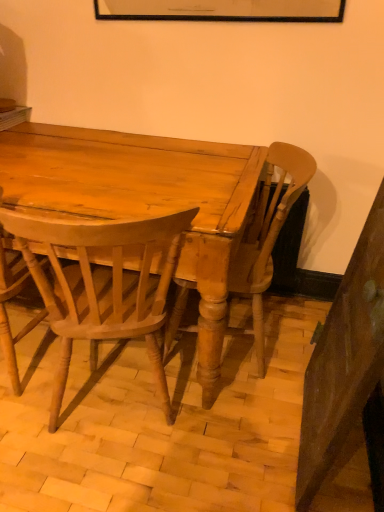
I want to click on matte wood desk at center, so click(144, 200).

What is the approximate width of light brown wood chair at center, acting as the 2th chair starting from the left?

light brown wood chair at center, acting as the 2th chair starting from the left, is 22.82 inches wide.

I want to click on light brown wood chair at center, placed as the 1th chair when sorted from right to left, so click(x=268, y=234).

From a real-world perspective, is matte wood desk at center positioned over light brown wood chair at center, marked as the third chair in a left-to-right arrangement, based on gravity?

Incorrect, from a real-world perspective, matte wood desk at center is lower than light brown wood chair at center, marked as the third chair in a left-to-right arrangement.

Based on the photo, from the image's perspective, is matte wood desk at center located beneath light brown wood chair at center, placed as the 1th chair when sorted from right to left?

Incorrect, from the image's perspective, matte wood desk at center is higher than light brown wood chair at center, placed as the 1th chair when sorted from right to left.

Is matte wood desk at center to the right of light brown wood chair at center, marked as the third chair in a left-to-right arrangement, from the viewer's perspective?

Incorrect, matte wood desk at center is not on the right side of light brown wood chair at center, marked as the third chair in a left-to-right arrangement.

Image resolution: width=384 pixels, height=512 pixels. Find the location of `the 2nd chair below the light brown wood chair at center, placed as the 1th chair when sorted from right to left (from the image's perspective)`. the 2nd chair below the light brown wood chair at center, placed as the 1th chair when sorted from right to left (from the image's perspective) is located at coordinates (102, 285).

Is light brown wood chair at center, the 2th chair from the right, directly adjacent to light brown wood chair at center, placed as the 1th chair when sorted from right to left?

No, light brown wood chair at center, the 2th chair from the right, is not with light brown wood chair at center, placed as the 1th chair when sorted from right to left.

Which object is further away from the camera, light brown wood chair at center, the 2th chair from the right, or light brown wood chair at center, placed as the 1th chair when sorted from right to left?

light brown wood chair at center, placed as the 1th chair when sorted from right to left, is further away from the camera.

How many degrees apart are the facing directions of light brown wood chair at center, acting as the 2th chair starting from the left, and light brown wood chair at center, marked as the third chair in a left-to-right arrangement?

There is a 73.2-degree angle between the facing directions of light brown wood chair at center, acting as the 2th chair starting from the left, and light brown wood chair at center, marked as the third chair in a left-to-right arrangement.

Does light brown wood chair at center, the 3th chair in the right-to-left sequence, have a lesser width compared to light brown wood chair at center, marked as the third chair in a left-to-right arrangement?

Incorrect, the width of light brown wood chair at center, the 3th chair in the right-to-left sequence, is not less than that of light brown wood chair at center, marked as the third chair in a left-to-right arrangement.

Are light brown wood chair at center, which ranks as the 1th chair in left-to-right order, and light brown wood chair at center, marked as the third chair in a left-to-right arrangement, located far from each other?

That's not correct — light brown wood chair at center, which ranks as the 1th chair in left-to-right order, is a little close to light brown wood chair at center, marked as the third chair in a left-to-right arrangement.

Is light brown wood chair at center, the 3th chair in the right-to-left sequence, looking in the opposite direction of light brown wood chair at center, placed as the 1th chair when sorted from right to left?

No, light brown wood chair at center, the 3th chair in the right-to-left sequence, is not facing away from light brown wood chair at center, placed as the 1th chair when sorted from right to left.

Who is more distant, light brown wood chair at center, which ranks as the 1th chair in left-to-right order, or light brown wood chair at center, marked as the third chair in a left-to-right arrangement?

light brown wood chair at center, marked as the third chair in a left-to-right arrangement, is behind.

Can you confirm if light brown wood chair at center, placed as the 1th chair when sorted from right to left, is bigger than light brown wood chair at center, the 3th chair in the right-to-left sequence?

Indeed, light brown wood chair at center, placed as the 1th chair when sorted from right to left, has a larger size compared to light brown wood chair at center, the 3th chair in the right-to-left sequence.

From the image's perspective, does light brown wood chair at center, marked as the third chair in a left-to-right arrangement, appear lower than light brown wood chair at center, the 3th chair in the right-to-left sequence?

Incorrect, from the image's perspective, light brown wood chair at center, marked as the third chair in a left-to-right arrangement, is higher than light brown wood chair at center, the 3th chair in the right-to-left sequence.

In the image, is light brown wood chair at center, placed as the 1th chair when sorted from right to left, positioned in front of or behind light brown wood chair at center, which ranks as the 1th chair in left-to-right order?

light brown wood chair at center, placed as the 1th chair when sorted from right to left, is positioned farther from the viewer than light brown wood chair at center, which ranks as the 1th chair in left-to-right order.

Considering the relative sizes of light brown wood chair at center, marked as the third chair in a left-to-right arrangement, and light brown wood chair at center, the 3th chair in the right-to-left sequence, in the image provided, is light brown wood chair at center, marked as the third chair in a left-to-right arrangement, taller than light brown wood chair at center, the 3th chair in the right-to-left sequence,?

Correct, light brown wood chair at center, marked as the third chair in a left-to-right arrangement, is much taller as light brown wood chair at center, the 3th chair in the right-to-left sequence.

In the scene shown: Between light brown wood chair at center, acting as the 2th chair starting from the left, and matte wood desk at center, which one has larger width?

Wider between the two is matte wood desk at center.

In the scene shown: Does light brown wood chair at center, the 2th chair from the right, contain matte wood desk at center?

Actually, matte wood desk at center is outside light brown wood chair at center, the 2th chair from the right.

Is light brown wood chair at center, the 2th chair from the right, aimed at matte wood desk at center?

Yes, light brown wood chair at center, the 2th chair from the right, is facing matte wood desk at center.

Which object is positioned more to the left, light brown wood chair at center, acting as the 2th chair starting from the left, or light brown wood chair at center, which ranks as the 1th chair in left-to-right order?

Positioned to the left is light brown wood chair at center, which ranks as the 1th chair in left-to-right order.

Based on the photo, how many degrees apart are the facing directions of light brown wood chair at center, the 2th chair from the right, and light brown wood chair at center, which ranks as the 1th chair in left-to-right order?

22 degrees separate the facing orientations of light brown wood chair at center, the 2th chair from the right, and light brown wood chair at center, which ranks as the 1th chair in left-to-right order.

Between light brown wood chair at center, acting as the 2th chair starting from the left, and light brown wood chair at center, which ranks as the 1th chair in left-to-right order, which one has less height?

Standing shorter between the two is light brown wood chair at center, acting as the 2th chair starting from the left.

Between light brown wood chair at center, acting as the 2th chair starting from the left, and light brown wood chair at center, which ranks as the 1th chair in left-to-right order, which one has smaller size?

light brown wood chair at center, which ranks as the 1th chair in left-to-right order, is smaller.

Where is `desk below the light brown wood chair at center, the 2th chair from the right (from a real-world perspective)`? The image size is (384, 512). desk below the light brown wood chair at center, the 2th chair from the right (from a real-world perspective) is located at coordinates (144, 200).

Based on the photo, does matte wood desk at center have a larger size compared to light brown wood chair at center, the 2th chair from the right?

Correct, matte wood desk at center is larger in size than light brown wood chair at center, the 2th chair from the right.

From the picture: Is matte wood desk at center not inside light brown wood chair at center, the 2th chair from the right?

Indeed, matte wood desk at center is completely outside light brown wood chair at center, the 2th chair from the right.

Who is taller, matte wood desk at center or light brown wood chair at center, acting as the 2th chair starting from the left?

Standing taller between the two is light brown wood chair at center, acting as the 2th chair starting from the left.

What are the coordinates of `desk located on the left of light brown wood chair at center, marked as the third chair in a left-to-right arrangement` in the screenshot? It's located at (144, 200).

Starting from the light brown wood chair at center, acting as the 2th chair starting from the left, which chair is the 2nd one behind? Please provide its 2D coordinates.

[(268, 234)]

Considering their positions, is light brown wood chair at center, placed as the 1th chair when sorted from right to left, positioned closer to light brown wood chair at center, acting as the 2th chair starting from the left, than light brown wood chair at center, the 3th chair in the right-to-left sequence?

Based on the image, light brown wood chair at center, the 3th chair in the right-to-left sequence, appears to be nearer to light brown wood chair at center, acting as the 2th chair starting from the left.

In the scene shown: Which object lies further to the anchor point light brown wood chair at center, marked as the third chair in a left-to-right arrangement, light brown wood chair at center, the 3th chair in the right-to-left sequence, or light brown wood chair at center, acting as the 2th chair starting from the left?

light brown wood chair at center, the 3th chair in the right-to-left sequence, lies further to light brown wood chair at center, marked as the third chair in a left-to-right arrangement, than the other object.

Based on their spatial positions, is light brown wood chair at center, placed as the 1th chair when sorted from right to left, or light brown wood chair at center, acting as the 2th chair starting from the left, closer to matte wood desk at center?

light brown wood chair at center, acting as the 2th chair starting from the left, is positioned closer to the anchor matte wood desk at center.

Estimate the real-world distances between objects in this image. Which object is closer to matte wood desk at center, light brown wood chair at center, acting as the 2th chair starting from the left, or light brown wood chair at center, the 3th chair in the right-to-left sequence?

light brown wood chair at center, acting as the 2th chair starting from the left, is positioned closer to the anchor matte wood desk at center.

Considering their positions, is light brown wood chair at center, the 2th chair from the right, positioned further to matte wood desk at center than light brown wood chair at center, marked as the third chair in a left-to-right arrangement?

light brown wood chair at center, marked as the third chair in a left-to-right arrangement, is positioned further to the anchor matte wood desk at center.

Based on their spatial positions, is light brown wood chair at center, acting as the 2th chair starting from the left, or light brown wood chair at center, which ranks as the 1th chair in left-to-right order, closer to light brown wood chair at center, placed as the 1th chair when sorted from right to left?

The object closer to light brown wood chair at center, placed as the 1th chair when sorted from right to left, is light brown wood chair at center, acting as the 2th chair starting from the left.

Based on their spatial positions, is light brown wood chair at center, placed as the 1th chair when sorted from right to left, or light brown wood chair at center, the 3th chair in the right-to-left sequence, further from matte wood desk at center?

Among the two, light brown wood chair at center, the 3th chair in the right-to-left sequence, is located further to matte wood desk at center.

Considering their positions, is light brown wood chair at center, acting as the 2th chair starting from the left, positioned closer to light brown wood chair at center, the 3th chair in the right-to-left sequence, than light brown wood chair at center, placed as the 1th chair when sorted from right to left?

Among the two, light brown wood chair at center, acting as the 2th chair starting from the left, is located nearer to light brown wood chair at center, the 3th chair in the right-to-left sequence.

In order to click on chair between matte wood desk at center and light brown wood chair at center, placed as the 1th chair when sorted from right to left, from left to right in this screenshot , I will do `click(102, 285)`.

Image resolution: width=384 pixels, height=512 pixels. Find the location of `chair between light brown wood chair at center, the 3th chair in the right-to-left sequence, and light brown wood chair at center, placed as the 1th chair when sorted from right to left`. chair between light brown wood chair at center, the 3th chair in the right-to-left sequence, and light brown wood chair at center, placed as the 1th chair when sorted from right to left is located at coordinates (102, 285).

Locate an element on the screen. This screenshot has height=512, width=384. desk situated between light brown wood chair at center, which ranks as the 1th chair in left-to-right order, and light brown wood chair at center, acting as the 2th chair starting from the left, from left to right is located at coordinates (144, 200).

This screenshot has height=512, width=384. Find the location of `desk located between light brown wood chair at center, which ranks as the 1th chair in left-to-right order, and light brown wood chair at center, placed as the 1th chair when sorted from right to left, in the left-right direction`. desk located between light brown wood chair at center, which ranks as the 1th chair in left-to-right order, and light brown wood chair at center, placed as the 1th chair when sorted from right to left, in the left-right direction is located at coordinates (144, 200).